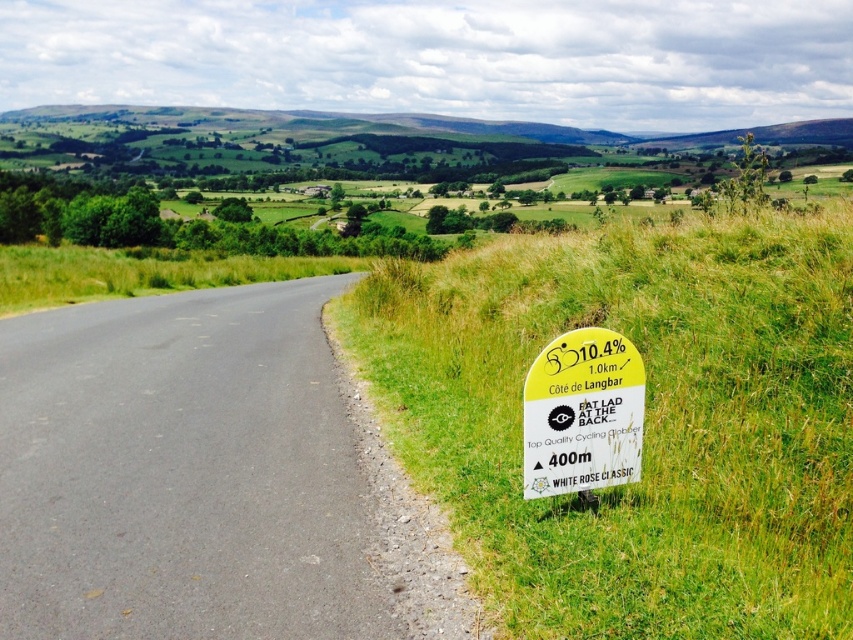
You are a hiker trying to navigate the trail. You see the green grassy at right and the yellow paper sign at right. Which one is wider in terms of horizontal space they occupy?

The green grassy at right is wider than the yellow paper sign at right in terms of horizontal space they occupy.

You are standing at the point marked by the coordinates (643, 420) in the image. Based on the scene description, what type of terrain are you currently standing on?

The point marked by the coordinates (643, 420) is on the green grassy area at the right, so you are standing on green grassy terrain.